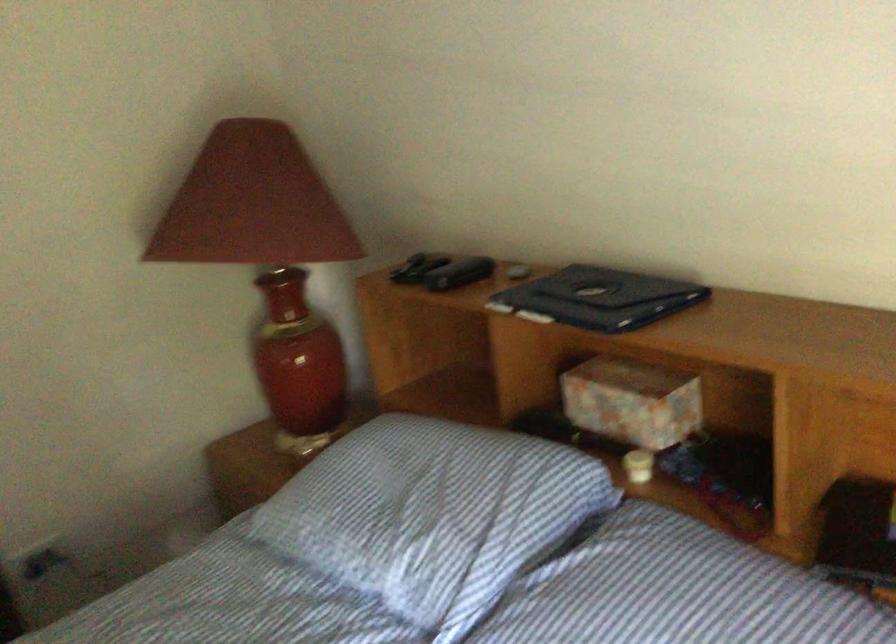
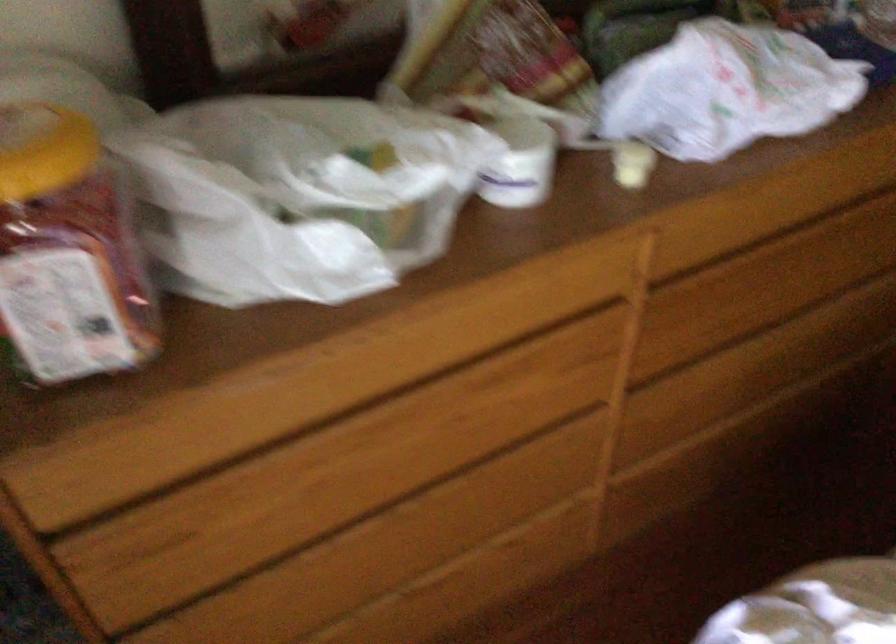
From the picture: The images are taken continuously from a first-person perspective. In which direction is your viewpoint rotating?

The camera rotated toward left-down.